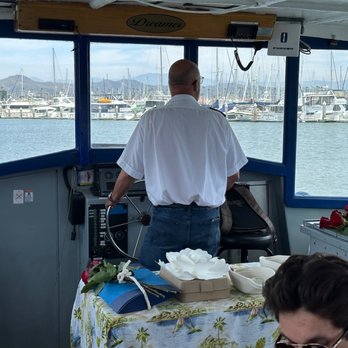
Where is `phone`? The height and width of the screenshot is (348, 348). phone is located at coordinates 83,210.